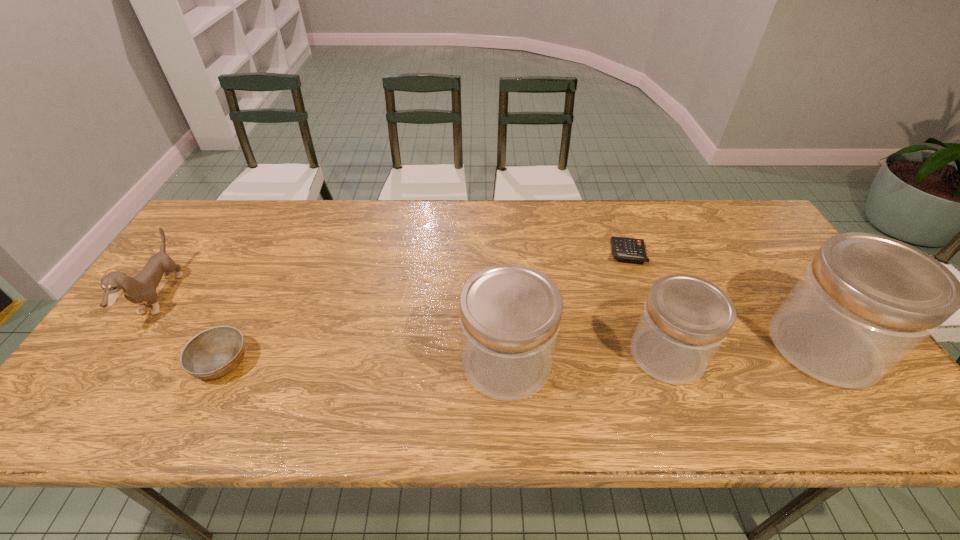
Locate an element on the screen. The width and height of the screenshot is (960, 540). object situated at the near right corner is located at coordinates pos(865,302).

Identify the location of free spot at the far edge of the desktop. (659, 242).

Find the location of a particular element. This screenshot has height=540, width=960. free space at the near edge of the desktop is located at coordinates (442, 380).

At what (x,y) coordinates should I click in order to perform the action: click on vacant space at the left edge of the desktop. Please return your answer as a coordinate pair (x, y). Looking at the image, I should click on click(x=120, y=335).

At what (x,y) coordinates should I click in order to perform the action: click on vacant space at the right edge of the desktop. Please return your answer as a coordinate pair (x, y). The image size is (960, 540). Looking at the image, I should click on (782, 269).

What are the coordinates of `free space at the far left corner of the desktop` in the screenshot? It's located at (223, 232).

The image size is (960, 540). In the image, there is a desktop. Find the location of `vacant space at the near left corner`. vacant space at the near left corner is located at coordinates (81, 387).

Image resolution: width=960 pixels, height=540 pixels. Find the location of `vacant area that lies between the second shortest object and the leftmost object`. vacant area that lies between the second shortest object and the leftmost object is located at coordinates (190, 330).

The height and width of the screenshot is (540, 960). What are the coordinates of `blank region between the fifth object from right to left and the calculator` in the screenshot? It's located at (424, 307).

Locate an element on the screen. free space between the shortest object and the second shortest object is located at coordinates (424, 307).